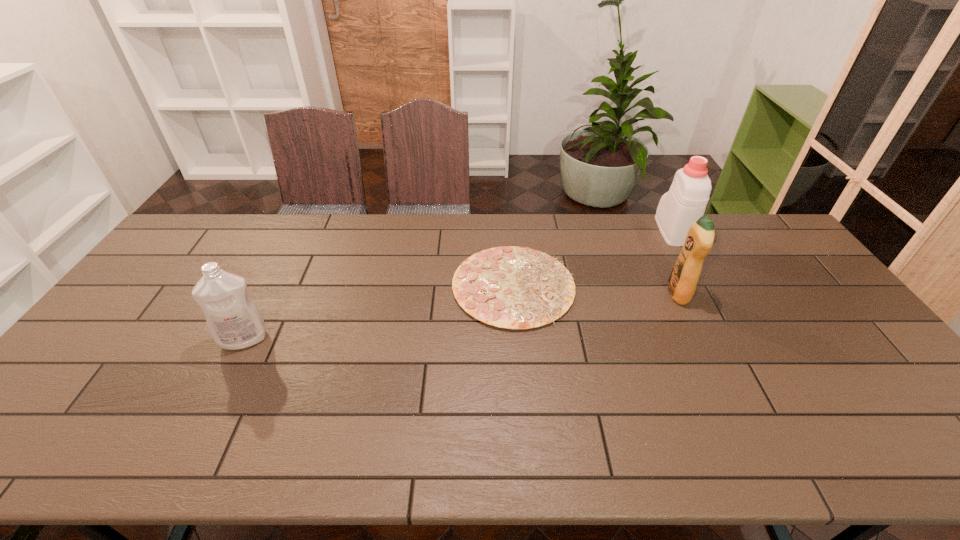
Where is `vacant space located on the label of the second object from right to left`? Image resolution: width=960 pixels, height=540 pixels. vacant space located on the label of the second object from right to left is located at coordinates (628, 294).

At what (x,y) coordinates should I click in order to perform the action: click on free space located on the right of the leftmost detergent. Please return your answer as a coordinate pair (x, y). Looking at the image, I should click on (364, 339).

Locate an element on the screen. vacant area located on the right of the shortest object is located at coordinates (673, 285).

Locate an element on the screen. This screenshot has width=960, height=540. detergent that is positioned at the far edge is located at coordinates (685, 202).

Locate an element on the screen. pizza that is positioned at the far edge is located at coordinates (511, 287).

Find the location of a particular element. Image resolution: width=960 pixels, height=540 pixels. vacant area at the far edge of the desktop is located at coordinates (556, 219).

The width and height of the screenshot is (960, 540). In the image, there is a desktop. In order to click on vacant space at the near edge in this screenshot , I will do `click(804, 464)`.

I want to click on vacant region at the left edge of the desktop, so click(x=151, y=342).

I want to click on free space between the farthest detergent and the third object from left to right, so click(x=675, y=262).

Image resolution: width=960 pixels, height=540 pixels. Identify the location of vacant area that lies between the farthest object and the second detergent from right to left. (675, 262).